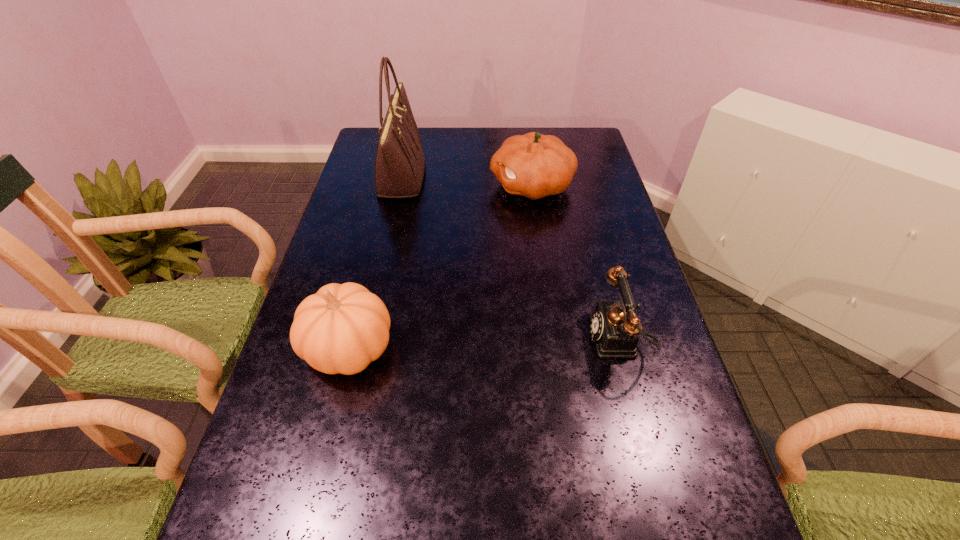
Locate an element on the screen. The width and height of the screenshot is (960, 540). the tallest object is located at coordinates (399, 161).

I want to click on the right pumpkin, so click(533, 165).

Identify the location of the left pumpkin. This screenshot has width=960, height=540. (342, 328).

Where is `telephone`? The height and width of the screenshot is (540, 960). telephone is located at coordinates (614, 327).

Image resolution: width=960 pixels, height=540 pixels. I want to click on free spot located 0.320m on the front-facing side of the handbag, so [518, 177].

Identify the location of vacant space situated on the front face of the farther pumpkin. (375, 186).

The height and width of the screenshot is (540, 960). I want to click on free space located 0.290m on the front face of the farther pumpkin, so click(402, 186).

Identify the location of free location located on the front face of the farther pumpkin. (394, 186).

This screenshot has height=540, width=960. What are the coordinates of `free spot located on the front of the nearer pumpkin` in the screenshot? It's located at (323, 453).

The width and height of the screenshot is (960, 540). Find the location of `free space located on the front of the telephone at the rotary dial`. free space located on the front of the telephone at the rotary dial is located at coordinates click(526, 339).